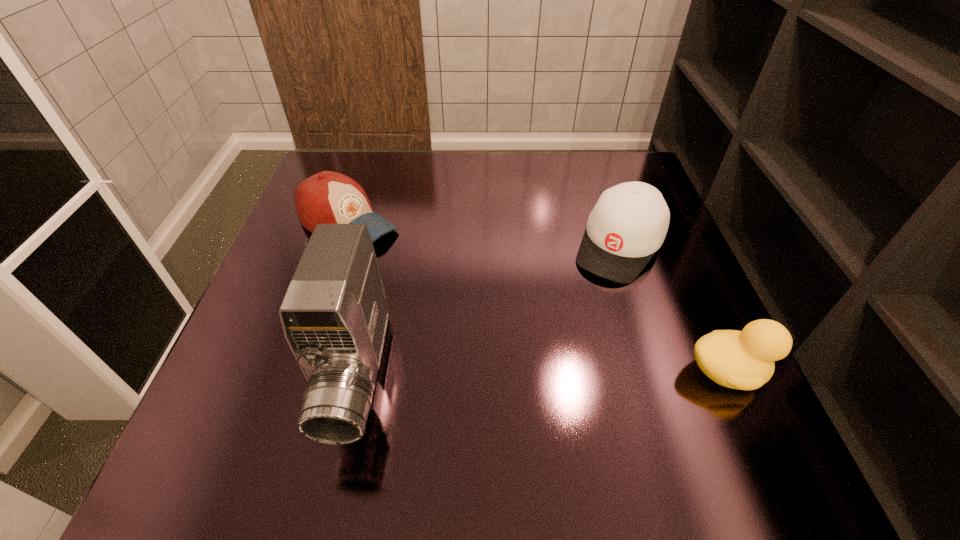
Image resolution: width=960 pixels, height=540 pixels. I want to click on vacant space that's between the right baseball cap and the tallest object, so click(489, 312).

Where is `the closest object to the tallest object`? Image resolution: width=960 pixels, height=540 pixels. the closest object to the tallest object is located at coordinates (327, 197).

The image size is (960, 540). Find the location of `object that ranks as the second closest to the duck`. object that ranks as the second closest to the duck is located at coordinates (334, 315).

Locate an element on the screen. This screenshot has height=540, width=960. vacant region that satisfies the following two spatial constraints: 1. on the front side of the left baseball cap; 2. on the front-facing side of the duck is located at coordinates (298, 372).